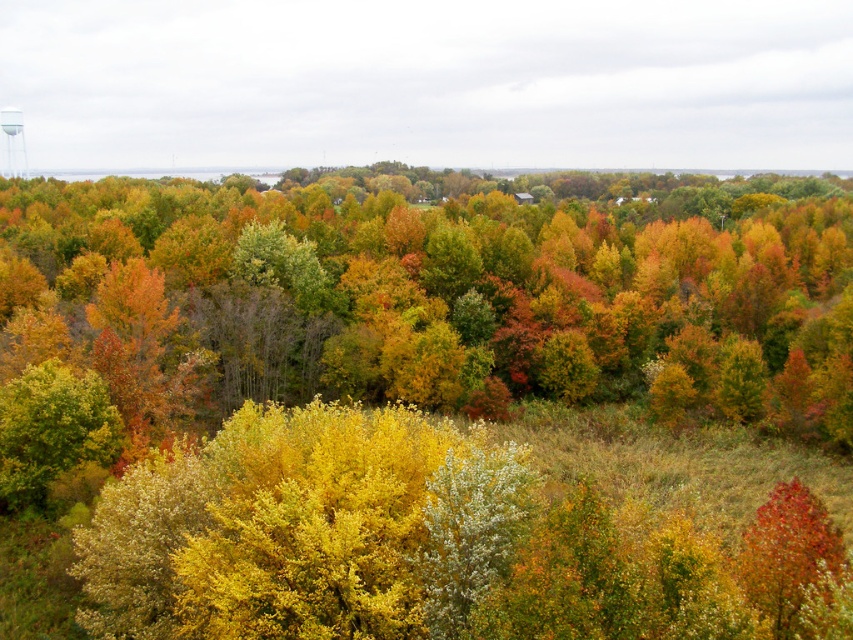
Can you confirm if yellow-green foliage at center is positioned to the left of white matte water tower at upper left?

Incorrect, yellow-green foliage at center is not on the left side of white matte water tower at upper left.

Does yellow-green foliage at center appear under white matte water tower at upper left?

Yes, yellow-green foliage at center is below white matte water tower at upper left.

Is point (312, 593) closer to camera compared to point (4, 122)?

Yes, point (312, 593) is in front of point (4, 122).

You are a GUI agent. You are given a task and a screenshot of the screen. Output one action in this format:
    pyautogui.click(x=<x>, y=<y>)
    Task: Click on the yellow-green foliage at center
    The height and width of the screenshot is (640, 853).
    Given the screenshot: What is the action you would take?
    pyautogui.click(x=405, y=400)